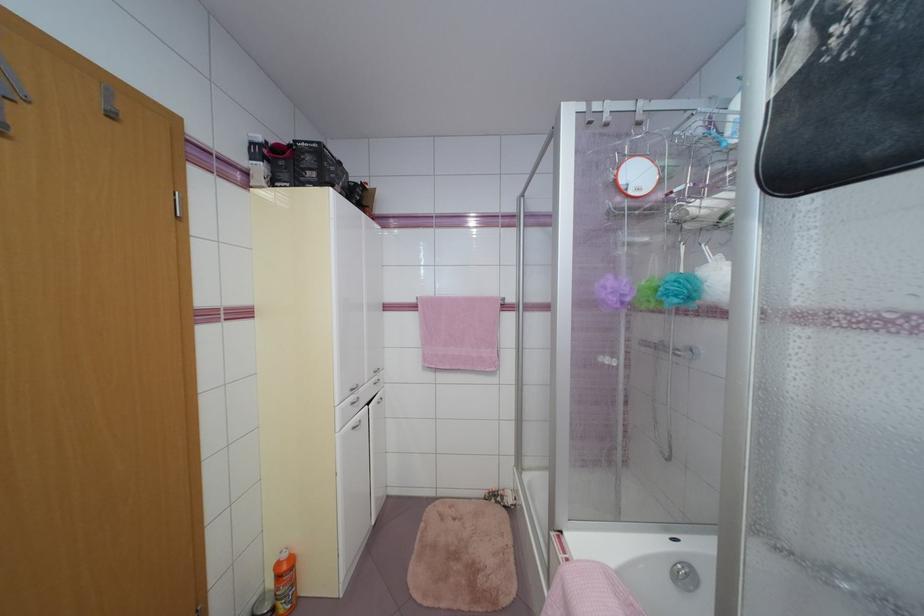
The height and width of the screenshot is (616, 924). I want to click on metal door hook, so pyautogui.click(x=110, y=103).